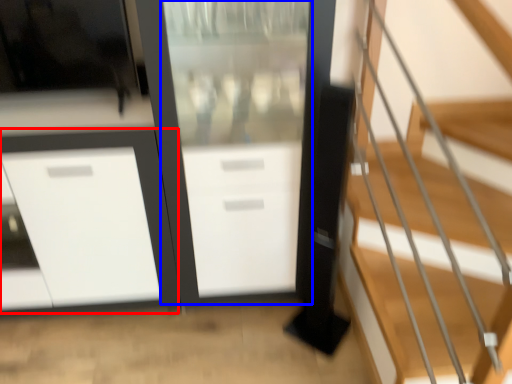
Question: Which object is closer to the camera taking this photo, cabinetry (highlighted by a red box) or screen door (highlighted by a blue box)?

Choices:
 (A) cabinetry
 (B) screen door

Answer: (B)